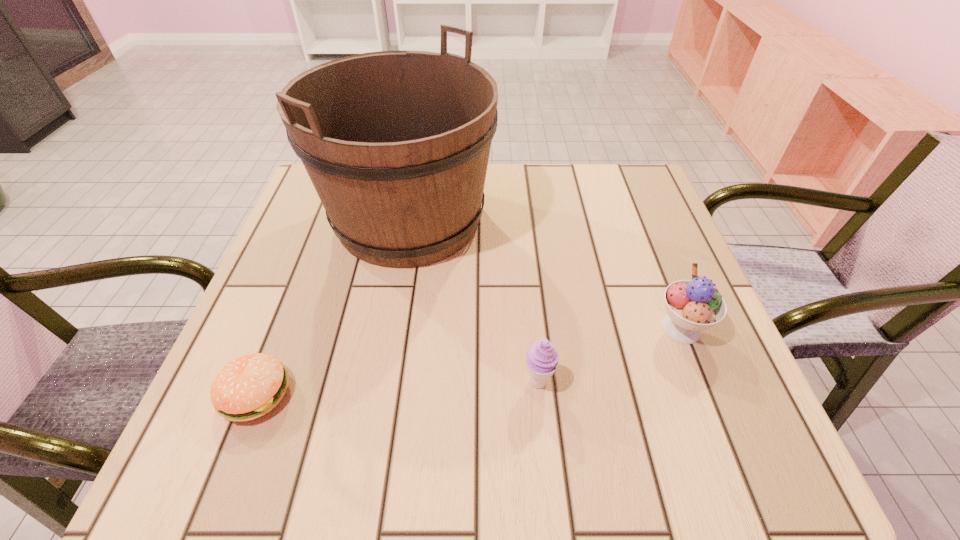
You are a GUI agent. You are given a task and a screenshot of the screen. Output one action in this format:
    pyautogui.click(x=<x>, y=<y>)
    Task: Click on the tallest object
    
    Given the screenshot: What is the action you would take?
    pyautogui.click(x=396, y=143)

Find the location of `the farthest object`. the farthest object is located at coordinates (396, 143).

Identify the location of the right icecream. (694, 305).

This screenshot has width=960, height=540. I want to click on the farther icecream, so click(694, 305).

At what (x,y) coordinates should I click in order to perform the action: click on the nearer icecream. Please return your answer as a coordinate pair (x, y). The width and height of the screenshot is (960, 540). Looking at the image, I should click on (541, 359).

Find the location of a particular element. the left icecream is located at coordinates (541, 359).

Identify the location of the shortest object. This screenshot has height=540, width=960. (250, 386).

Where is `free space located on the right of the farthest object`? This screenshot has width=960, height=540. free space located on the right of the farthest object is located at coordinates (619, 220).

Locate an element on the screen. free location located on the front of the rightmost object is located at coordinates click(727, 444).

The width and height of the screenshot is (960, 540). I want to click on vacant region located 0.290m on the right of the nearer icecream, so click(723, 382).